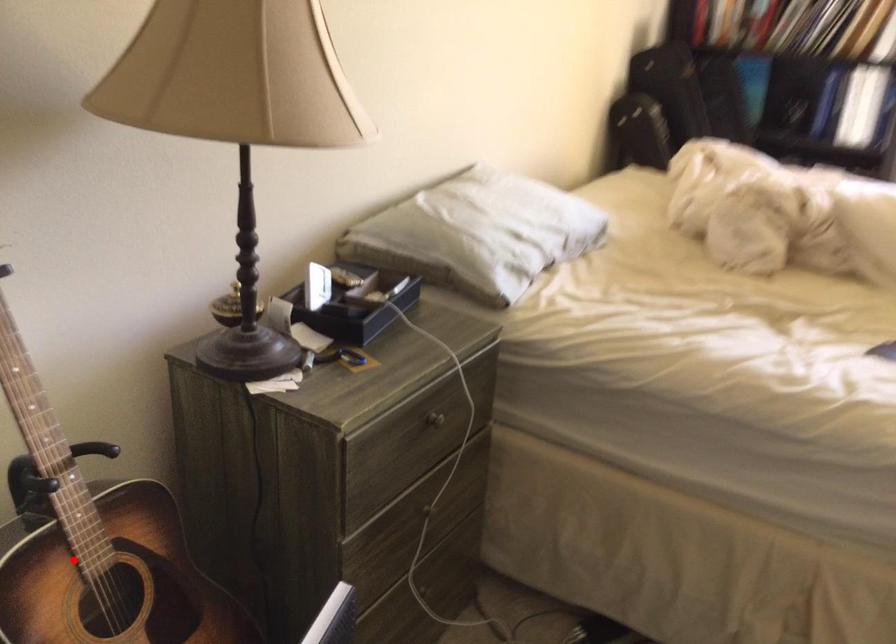
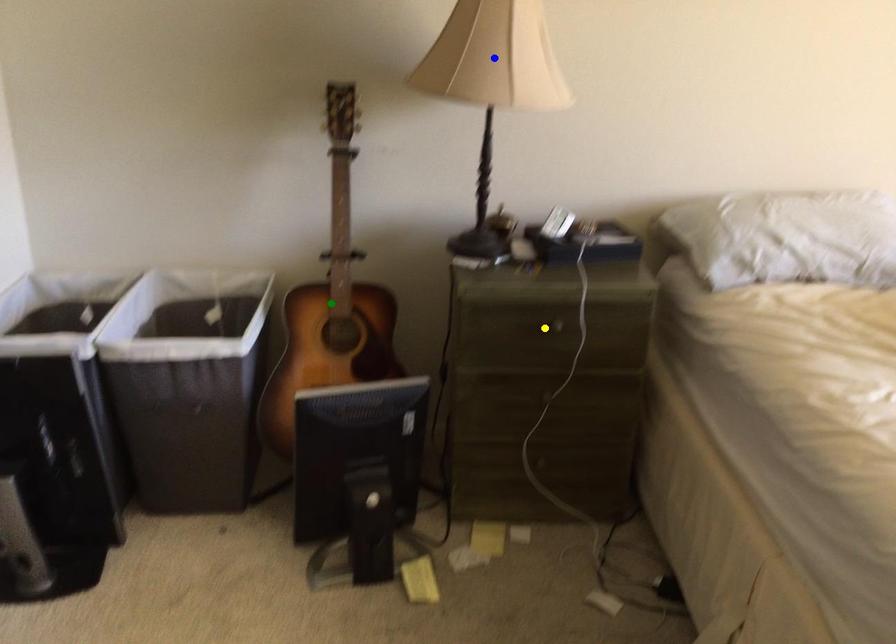
Question: I am providing you with two images of the same scene from different viewpoints. A red point is marked on the first image. You are given multiple points on the second image. Can you choose the point in image 2 that corresponds to the point in image 1?

Choices:
 (A) yellow point
 (B) blue point
 (C) green point

Answer: (C)